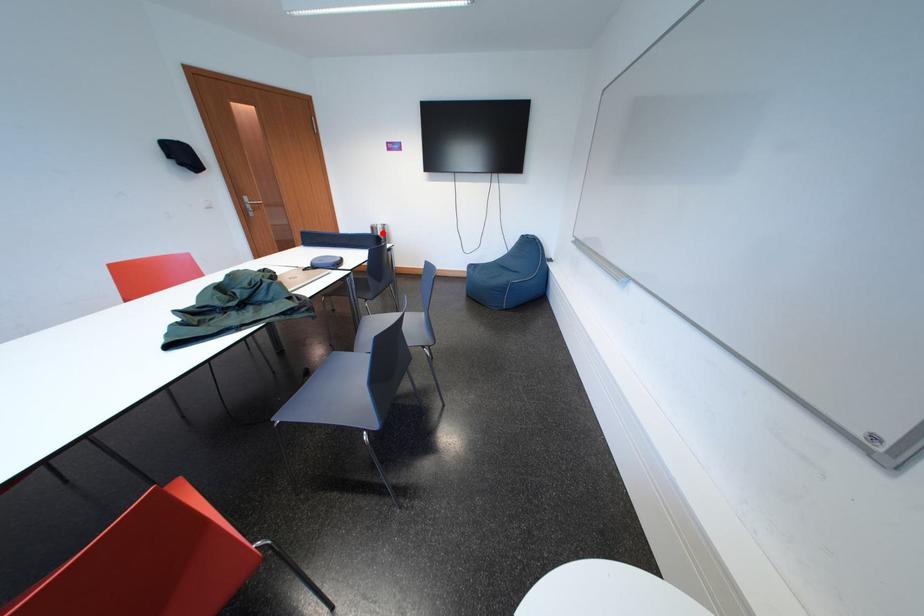
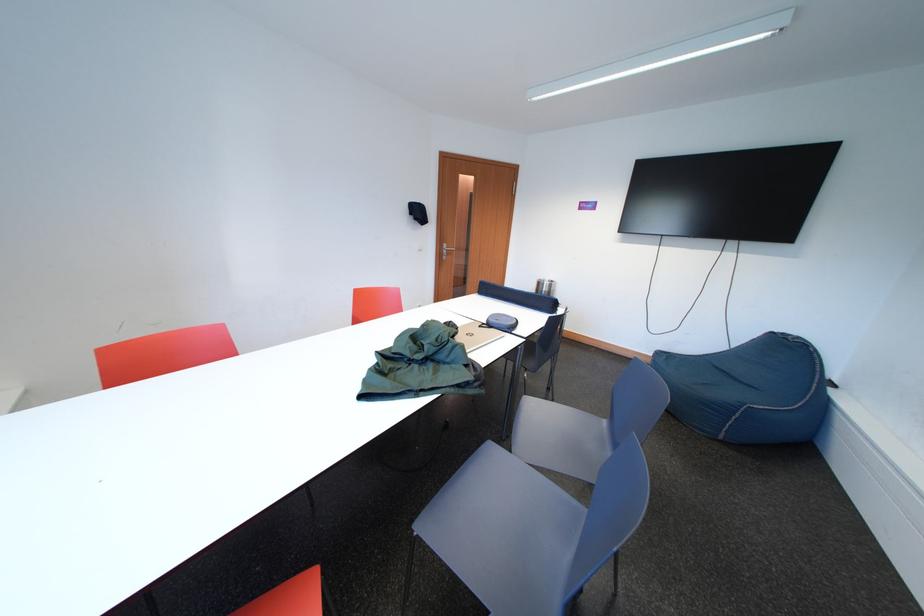
In the second image, find the point that corresponds to the highlighted location in the first image.

(549, 288)